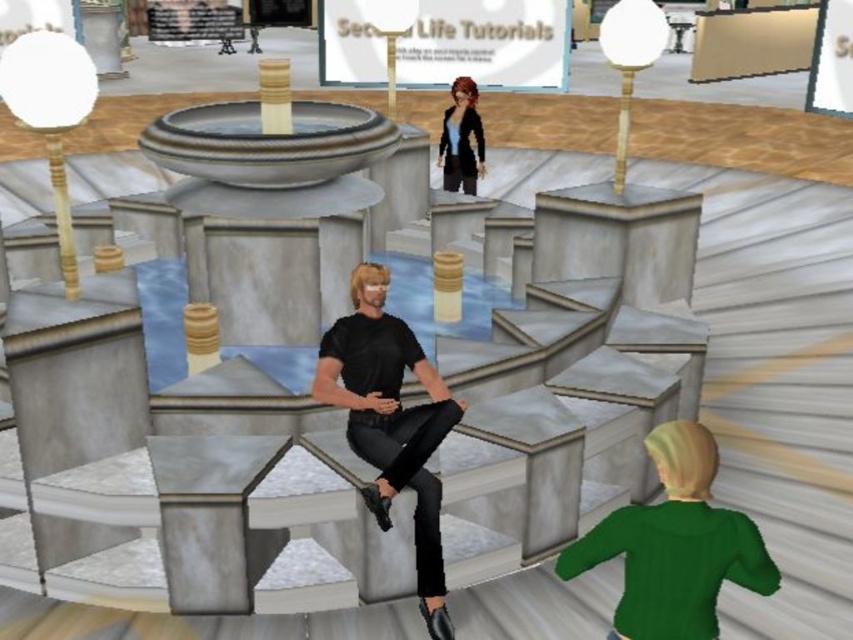
You are an avatar in Second Life and want to check the size of your clothing items. You have the black matte pants at center and the matte black jacket at upper center. Which clothing item is larger?

The matte black jacket at upper center is larger than the black matte pants at center.

You are an avatar in Second Life Tutorials. You see a green matte sweater at lower right and a black matte pants at center. Which one is positioned lower in the scene?

The green matte sweater at lower right is positioned lower than the black matte pants at center.